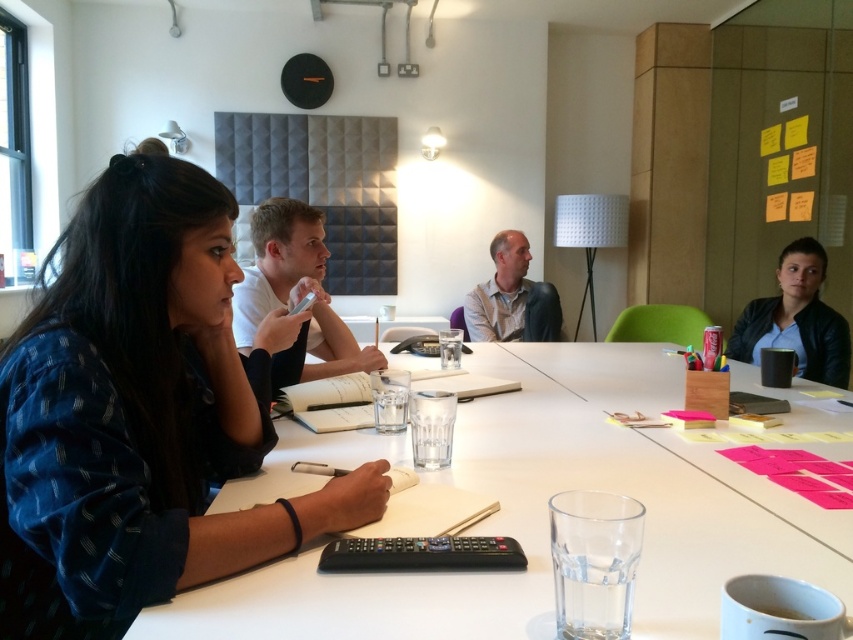
Consider the image. You are standing at the point labeled point (57,561) in a room with a camera. If you want to move closer to the camera, which direction should you move?

Since the point (57,561) and the camera are 30.59 inches apart, you should move towards the camera to reduce the distance between them.

You are a guest entering the room and need to sit down. You see the blue printed shirt at left and the white plastic table at center. Which object should you approach first to find a seat?

You should approach the white plastic table at center first because the blue printed shirt at left is to the left of it, meaning the table is further to the right and likely part of the seating area.

You are organizing a photoshoot and need to ensure that all clothing items in the image are appropriately sized for the models. Given that the blue printed shirt at left and the matte black jacket at upper right are both part of the scene, which clothing item has a greater width?

The blue printed shirt at left has a greater width than the matte black jacket at upper right according to the description.